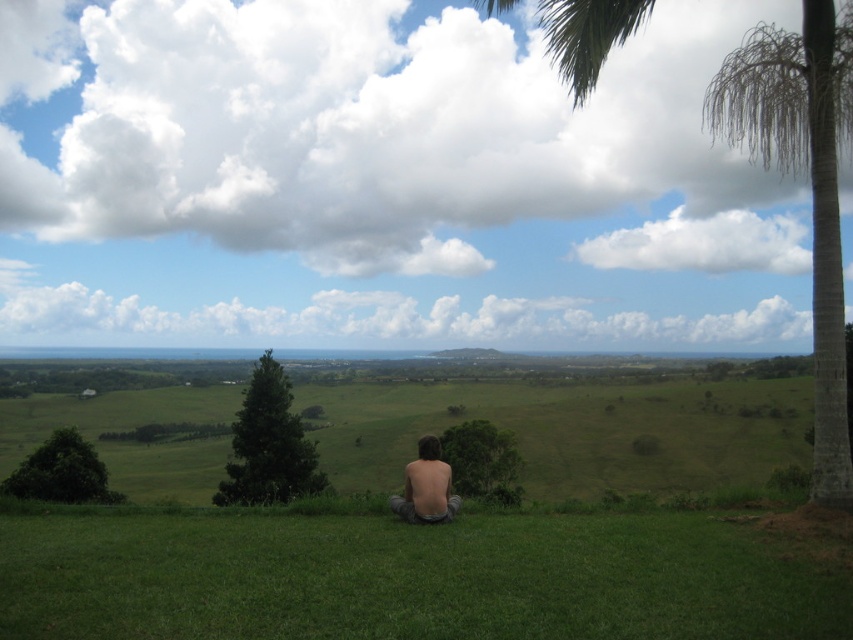
Between point (810, 144) and point (485, 454), which one is positioned behind?

Positioned behind is point (485, 454).

The height and width of the screenshot is (640, 853). Describe the element at coordinates (810, 184) in the screenshot. I see `green textured palm tree at right` at that location.

The height and width of the screenshot is (640, 853). What are the coordinates of `green textured palm tree at right` in the screenshot? It's located at (810, 184).

Locate an element on the screen. The width and height of the screenshot is (853, 640). green textured palm tree at right is located at coordinates (810, 184).

Is green grassy at center further to camera compared to shiny brown hair at center?

No.

This screenshot has width=853, height=640. What do you see at coordinates (408, 579) in the screenshot? I see `green grassy at center` at bounding box center [408, 579].

Is point (219, 520) less distant than point (444, 500)?

That is False.

At what (x,y) coordinates should I click in order to perform the action: click on green grassy at center. Please return your answer as a coordinate pair (x, y). Looking at the image, I should click on (408, 579).

Can you confirm if green matte tree at center is positioned to the right of green leafy tree at center?

In fact, green matte tree at center is to the left of green leafy tree at center.

Is green matte tree at center further to camera compared to green leafy tree at center?

Yes, it is.

Locate an element on the screen. green matte tree at center is located at coordinates pyautogui.click(x=268, y=444).